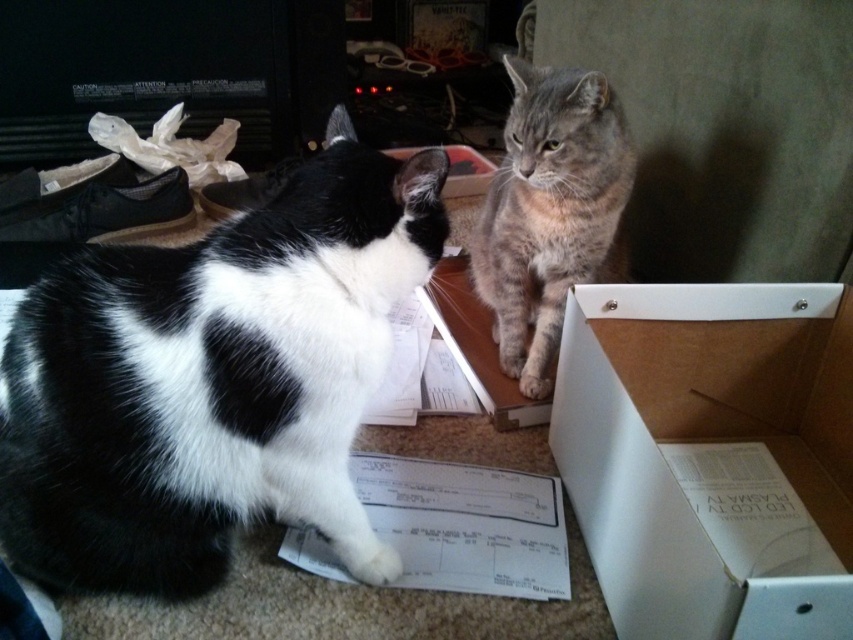
Question: Can you confirm if black and white fur cat at left is wider than white cardboard box at lower right?

Choices:
 (A) no
 (B) yes

Answer: (B)

Question: Observing the image, what is the correct spatial positioning of black and white fur cat at left in reference to gray tabby cat at center?

Choices:
 (A) left
 (B) right

Answer: (A)

Question: Which point appears farthest from the camera in this image?

Choices:
 (A) (540, 323)
 (B) (113, 371)
 (C) (747, 333)

Answer: (A)

Question: Which point appears closest to the camera in this image?

Choices:
 (A) (48, 339)
 (B) (604, 128)

Answer: (A)

Question: Based on their relative distances, which object is farther from the gray tabby cat at center?

Choices:
 (A) white cardboard box at lower right
 (B) black and white fur cat at left

Answer: (B)

Question: Considering the relative positions of white cardboard box at lower right and gray tabby cat at center in the image provided, where is white cardboard box at lower right located with respect to gray tabby cat at center?

Choices:
 (A) right
 (B) left

Answer: (A)